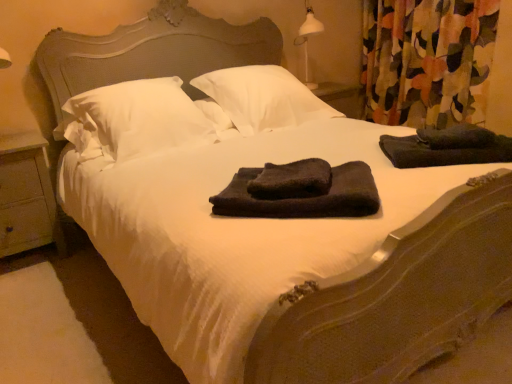
Question: Based on their sizes in the image, would you say dark gray plush bath towel at center, placed as the second bath towel when sorted from left to right, is bigger or smaller than dark gray plush bath towel at center, marked as the 1th bath towel in a left-to-right arrangement?

Choices:
 (A) small
 (B) big

Answer: (B)

Question: Is dark gray plush bath towel at center, placed as the second bath towel when sorted from left to right, inside or outside of dark gray plush bath towel at center, the second bath towel when ordered from right to left?

Choices:
 (A) inside
 (B) outside

Answer: (B)

Question: Considering the real-world distances, which object is closest to the dark gray towel at right?

Choices:
 (A) dark gray plush bath towel at center, placed as the second bath towel when sorted from left to right
 (B) white soft pillow at center, the 2th pillow from the left
 (C) floral fabric curtain at upper right
 (D) dark gray plush bath towel at center, the second bath towel when ordered from right to left
 (E) wooden at left

Answer: (A)

Question: Based on their relative distances, which object is nearer to the floral fabric curtain at upper right?

Choices:
 (A) dark gray plush bath towel at center, arranged as the first bath towel when viewed from the right
 (B) white soft pillow at center, the 2th pillow from the left
 (C) dark gray towel at right
 (D) white soft pillow at center, the 2th pillow from the right
 (E) wooden at left

Answer: (B)